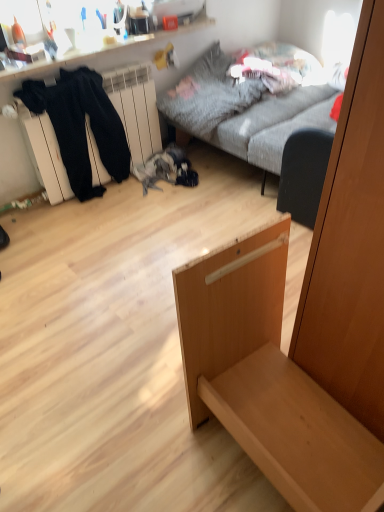
The image size is (384, 512). Describe the element at coordinates (268, 379) in the screenshot. I see `light wood drawer at center` at that location.

What do you see at coordinates (304, 174) in the screenshot? This screenshot has height=512, width=384. I see `black fabric armchair at center` at bounding box center [304, 174].

In order to face black fabric armchair at center, should I rotate leftwards or rightwards?

To align with it, rotate right about 14.691°.

The width and height of the screenshot is (384, 512). Identify the location of gray fabric couch at upper center. (251, 116).

How many degrees apart are the facing directions of black fabric armchair at center and gray fabric couch at upper center?

The angular difference between black fabric armchair at center and gray fabric couch at upper center is 90 degrees.

Would you say gray fabric couch at upper center is part of black fabric armchair at center's contents?

That's incorrect, gray fabric couch at upper center is not inside black fabric armchair at center.

Considering their positions, is black fabric armchair at center located in front of or behind gray fabric couch at upper center?

Visually, black fabric armchair at center is located behind gray fabric couch at upper center.

Can you confirm if black fabric armchair at center is taller than gray fabric couch at upper center?

No, black fabric armchair at center is not taller than gray fabric couch at upper center.

Consider the image. How different are the orientations of light wood drawer at center and gray fabric couch at upper center in degrees?

There is a 98-degree angle between the facing directions of light wood drawer at center and gray fabric couch at upper center.

Between light wood drawer at center and gray fabric couch at upper center, which one has less height?

Standing shorter between the two is gray fabric couch at upper center.

What are the coordinates of `furniture above the gray fabric couch at upper center (from a real-world perspective)` in the screenshot? It's located at (268, 379).

How far apart are black fabric armchair at center and black cotton pants at left?

A distance of 3.56 feet exists between black fabric armchair at center and black cotton pants at left.

Is black fabric armchair at center further to camera compared to black cotton pants at left?

No, it is in front of black cotton pants at left.

Is black fabric armchair at center aimed at black cotton pants at left?

No, black fabric armchair at center is not facing towards black cotton pants at left.

Does black fabric armchair at center have a lesser height compared to black cotton pants at left?

Yes.

From the picture: In the image, is black cotton pants at left positioned in front of or behind black fabric armchair at center?

In the image, black cotton pants at left appears behind black fabric armchair at center.

Is black cotton pants at left not within black fabric armchair at center?

Indeed, black cotton pants at left is completely outside black fabric armchair at center.

Which is more to the left, black cotton pants at left or black fabric armchair at center?

black cotton pants at left is more to the left.

From the image's perspective, is black cotton pants at left located above black fabric armchair at center?

Yes.

Locate an element on the screen. furniture in front of the black fabric armchair at center is located at coordinates (268, 379).

Is light wood drawer at center facing towards black fabric armchair at center?

No, light wood drawer at center is not turned towards black fabric armchair at center.

Considering the positions of objects light wood drawer at center and black fabric armchair at center in the image provided, who is in front, light wood drawer at center or black fabric armchair at center?

Positioned in front is light wood drawer at center.

Can you tell me how much black fabric armchair at center and light wood drawer at center differ in facing direction?

They differ by 8.03 degrees in their facing directions.

Considering the relative sizes of black fabric armchair at center and light wood drawer at center in the image provided, is black fabric armchair at center wider than light wood drawer at center?

No, black fabric armchair at center is not wider than light wood drawer at center.

Which object is positioned more to the left, black fabric armchair at center or light wood drawer at center?

From the viewer's perspective, light wood drawer at center appears more on the left side.

Which point is more distant from viewer, (303,204) or (241,408)?

The point (303,204) is farther.

Can you tell me how much gray fabric couch at upper center and black fabric armchair at center differ in facing direction?

The angular difference between gray fabric couch at upper center and black fabric armchair at center is 90 degrees.

Is gray fabric couch at upper center taller or shorter than black fabric armchair at center?

gray fabric couch at upper center is taller than black fabric armchair at center.

Between gray fabric couch at upper center and black fabric armchair at center, which one is positioned behind?

black fabric armchair at center.

In terms of width, does gray fabric couch at upper center look wider or thinner when compared to black fabric armchair at center?

Clearly, gray fabric couch at upper center has more width compared to black fabric armchair at center.

You are a GUI agent. You are given a task and a screenshot of the screen. Output one action in this format:
    pyautogui.click(x=<x>, y=<y>)
    Task: Click on the studio couch that is above the black fabric armchair at center (from a real-world perspective)
    This screenshot has height=512, width=384.
    Given the screenshot: What is the action you would take?
    pyautogui.click(x=251, y=116)

Locate an element on the screen. furniture on the left of gray fabric couch at upper center is located at coordinates (268, 379).

Estimate the real-world distances between objects in this image. Which object is closer to gray fabric couch at upper center, black fabric armchair at center or light wood drawer at center?

black fabric armchair at center is closer to gray fabric couch at upper center.

When comparing their distances from light wood drawer at center, does black cotton pants at left or black fabric armchair at center seem closer?

black fabric armchair at center.

From the image, which object appears to be nearer to light wood drawer at center, gray fabric couch at upper center or black fabric armchair at center?

black fabric armchair at center.

From the image, which object appears to be nearer to light wood drawer at center, black fabric armchair at center or black cotton pants at left?

black fabric armchair at center lies closer to light wood drawer at center than the other object.

From the image, which object appears to be nearer to black fabric armchair at center, black cotton pants at left or light wood drawer at center?

light wood drawer at center is positioned closer to the anchor black fabric armchair at center.

From the image, which object appears to be farther from black cotton pants at left, black fabric armchair at center or light wood drawer at center?

light wood drawer at center.

When comparing their distances from light wood drawer at center, does gray fabric couch at upper center or black cotton pants at left seem further?

The object further to light wood drawer at center is black cotton pants at left.

Considering their positions, is light wood drawer at center positioned further to black cotton pants at left than gray fabric couch at upper center?

Based on the image, light wood drawer at center appears to be further to black cotton pants at left.

The height and width of the screenshot is (512, 384). I want to click on studio couch between light wood drawer at center and black fabric armchair at center in the front-back direction, so click(x=251, y=116).

The width and height of the screenshot is (384, 512). I want to click on studio couch positioned between light wood drawer at center and black cotton pants at left from near to far, so click(251, 116).

Image resolution: width=384 pixels, height=512 pixels. I want to click on armchair located between black cotton pants at left and gray fabric couch at upper center in the left-right direction, so click(304, 174).

Locate an element on the screen. The image size is (384, 512). armchair between light wood drawer at center and black cotton pants at left from front to back is located at coordinates (304, 174).